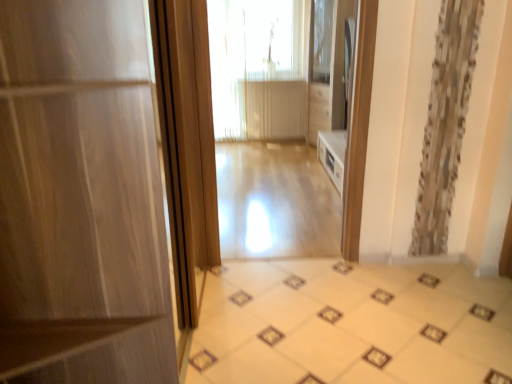
Question: From their relative heights in the image, would you say light wood floor at center is taller or shorter than matte wood door at left?

Choices:
 (A) short
 (B) tall

Answer: (A)

Question: Based on their positions, is light wood floor at center located to the left or right of matte wood door at left?

Choices:
 (A) right
 (B) left

Answer: (A)

Question: Which of these objects is positioned closest to the light wood floor at center?

Choices:
 (A) beige glossy tile at center
 (B) translucent fabric at center
 (C) matte wood door at left
 (D) light wood floor at center

Answer: (B)

Question: Which object is positioned farthest from the beige glossy tile at center?

Choices:
 (A) matte wood door at left
 (B) translucent fabric at center
 (C) light wood floor at center
 (D) light wood floor at center

Answer: (B)